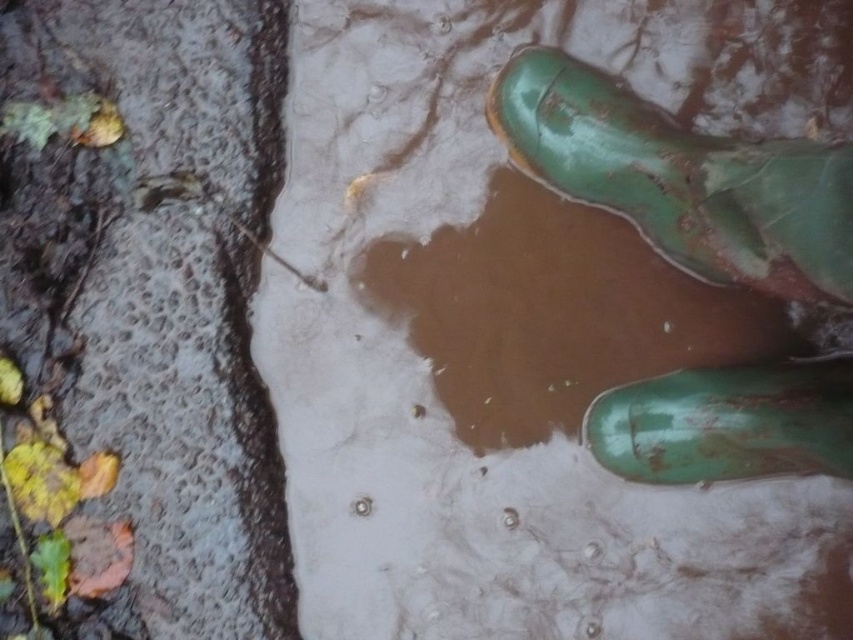
You are a photographer trying to capture the brown matte mud at lower left and the green rubber boot at lower right in a single frame. Which object will occupy more horizontal space in your photo?

The brown matte mud at lower left will occupy more horizontal space in the photo because its width surpasses that of the green rubber boot at lower right.